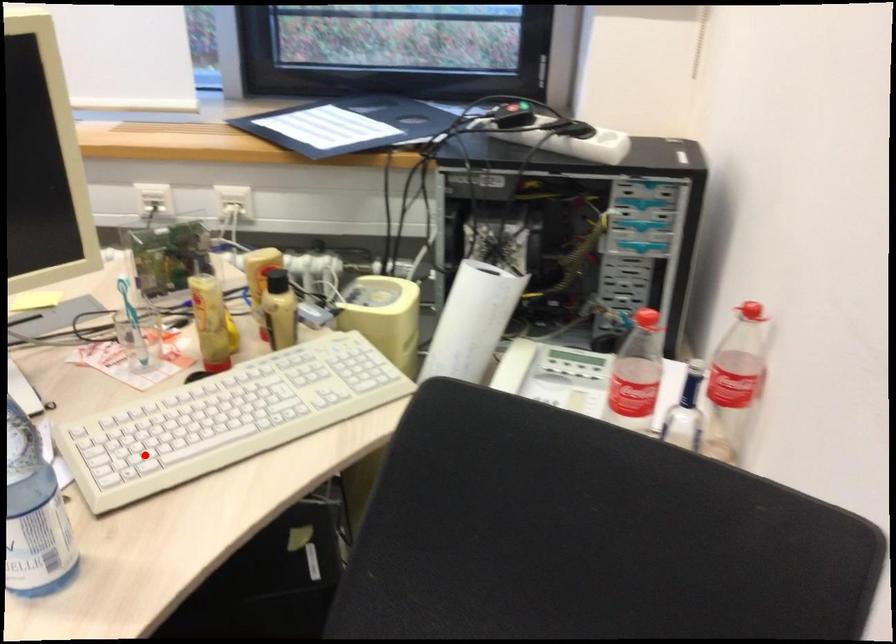
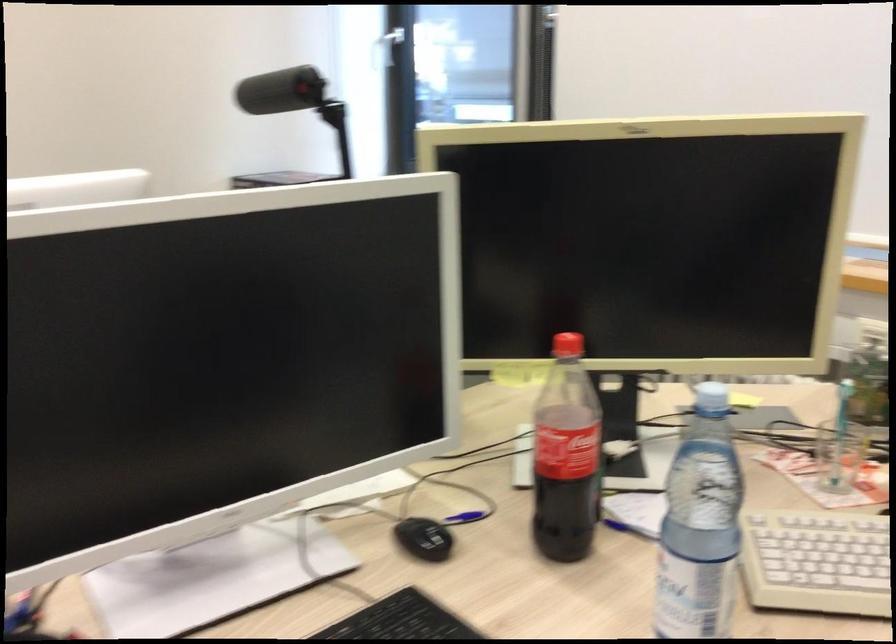
Question: I am providing you with two images of the same scene from different viewpoints. In image1, a red point is highlighted. Considering the same 3D point in image2, which of the following is correct?

Choices:
 (A) It is closer
 (B) It is farther

Answer: (A)